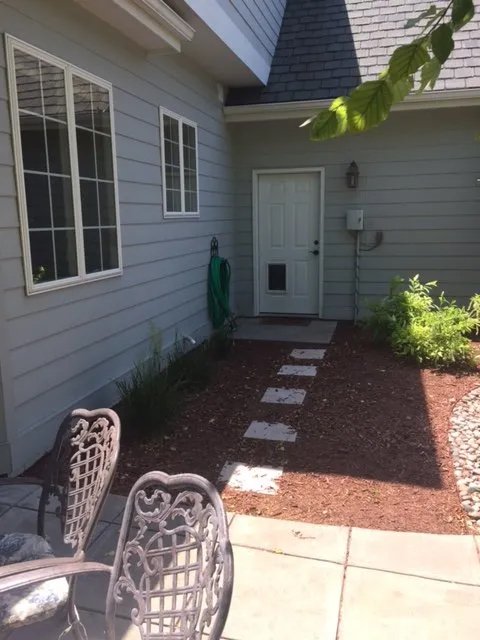
Where is `door`? This screenshot has height=640, width=480. door is located at coordinates (289, 244).